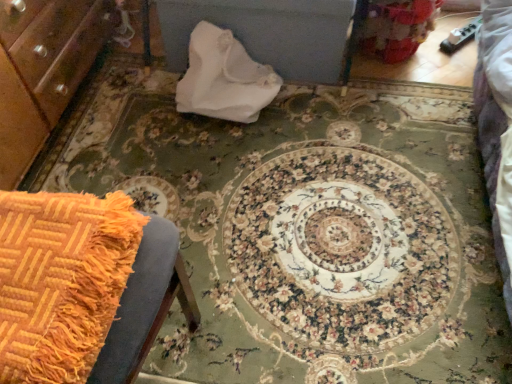
Locate an element on the screen. The image size is (512, 384). free space in front of white paper bag at center is located at coordinates (228, 162).